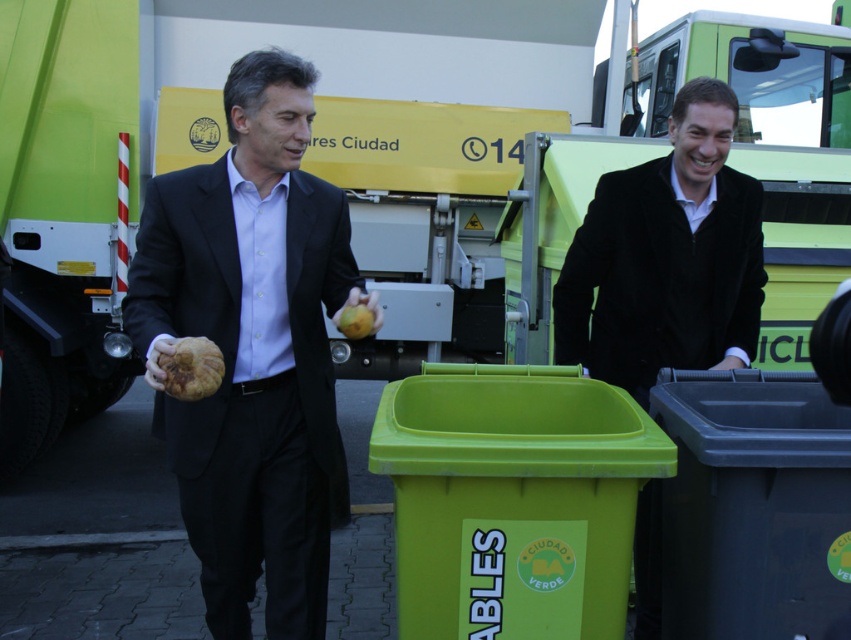
You are a fashion designer who needs to place a new accessory between the matte black suit at center and the black velvet suit at right. The accessory requires a minimum of 1 meter of space. Is there enough space between them to place it?

The matte black suit at center is 1.19 meters from the black velvet suit at right, so yes, there is enough space to place the accessory between them since the distance is more than the required 1 meter.

You are standing in front of the two men and want to place a recyclable item into the black plastic recycling bin at lower right. Considering the distance, can you reach it without moving closer?

The black plastic recycling bin at lower right is 7.26 feet away from the viewer. Since the average person can comfortably reach about 6 feet without moving, you would need to take a step forward to place the item into the bin.